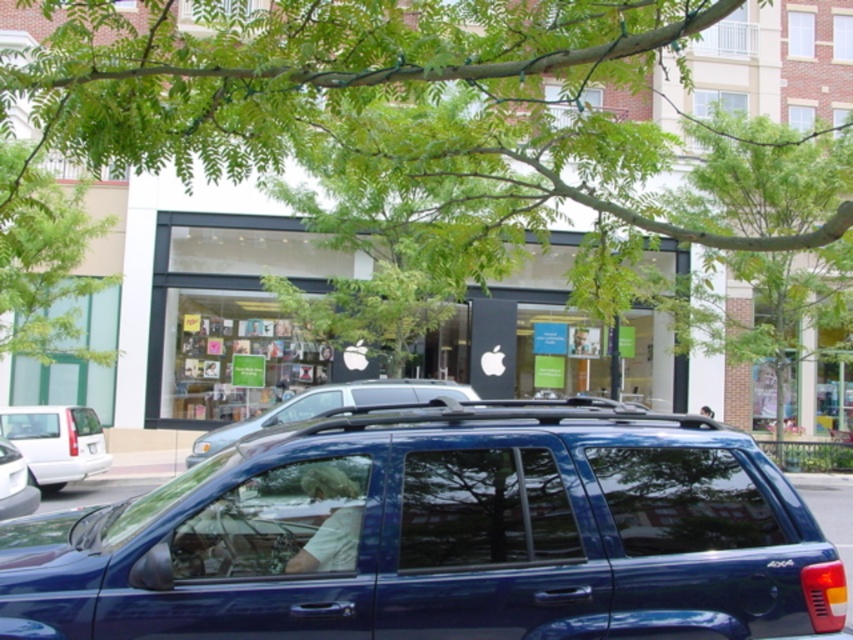
You are a pedestrian standing on the sidewalk and want to cross the street. You see the white matte van at left and the metallic blue suv at center. Which vehicle is closer to you?

The white matte van at left is closer to the viewer than the metallic blue suv at center, so the white matte van at left is closer to you.